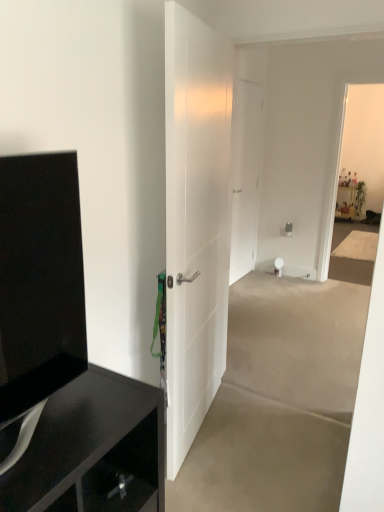
Describe the element at coordinates (92, 450) in the screenshot. Image resolution: width=384 pixels, height=512 pixels. I see `black glossy cabinet at left` at that location.

This screenshot has height=512, width=384. Describe the element at coordinates (245, 176) in the screenshot. I see `white matte door at center, which is the first door from back to front` at that location.

Identify the location of white smooth door at center, the first door positioned from the front. (195, 221).

Can you confirm if black glossy tv cabinet at left is taller than black glossy cabinet at left?

Incorrect, the height of black glossy tv cabinet at left is not larger of that of black glossy cabinet at left.

You are a GUI agent. You are given a task and a screenshot of the screen. Output one action in this format:
    pyautogui.click(x=<x>, y=<y>)
    Task: Click on the cabinetry on the right side of black glossy tv cabinet at left
    This screenshot has width=384, height=512.
    Given the screenshot: What is the action you would take?
    pyautogui.click(x=92, y=450)

Is the surface of black glossy tv cabinet at left in direct contact with black glossy cabinet at left?

No, black glossy tv cabinet at left is not in contact with black glossy cabinet at left.

Consider the image. Would you say black glossy tv cabinet at left is outside black glossy cabinet at left?

Indeed, black glossy tv cabinet at left is completely outside black glossy cabinet at left.

In the scene shown: From the image's perspective, is white smooth door at center, which is the 2th door in back-to-front order, located above black glossy tv cabinet at left?

Yes, from the image's perspective, white smooth door at center, which is the 2th door in back-to-front order, is on top of black glossy tv cabinet at left.

Looking at this image, does white smooth door at center, arranged as the second door when viewed from the right, have a smaller size compared to black glossy tv cabinet at left?

Incorrect, white smooth door at center, arranged as the second door when viewed from the right, is not smaller in size than black glossy tv cabinet at left.

Which of these two, white smooth door at center, the first door in the left-to-right sequence, or black glossy tv cabinet at left, is thinner?

white smooth door at center, the first door in the left-to-right sequence, is thinner.

Is white smooth door at center, the first door positioned from the front, facing towards black glossy tv cabinet at left?

No, white smooth door at center, the first door positioned from the front, does not turn towards black glossy tv cabinet at left.

Consider the image. Can you confirm if white matte door at center, the first door when ordered from right to left, is positioned to the left of black glossy cabinet at left?

Incorrect, white matte door at center, the first door when ordered from right to left, is not on the left side of black glossy cabinet at left.

Is white matte door at center, which is the second door from left to right, wider or thinner than black glossy cabinet at left?

Clearly, white matte door at center, which is the second door from left to right, has less width compared to black glossy cabinet at left.

From the picture: From a real-world perspective, between white matte door at center, which is counted as the 2th door, starting from the front, and black glossy cabinet at left, who is vertically lower?

black glossy cabinet at left is physically lower.

What's the angular difference between black glossy cabinet at left and black glossy tv cabinet at left's facing directions?

0.434 degrees.

Is black glossy cabinet at left positioned far away from black glossy tv cabinet at left?

No, black glossy cabinet at left is not far away from black glossy tv cabinet at left.

Does point (68, 410) come in front of point (1, 250)?

No, it is behind (1, 250).

Is white matte door at center, which is the first door from back to front, wider or thinner than white smooth door at center, the first door positioned from the front?

In the image, white matte door at center, which is the first door from back to front, appears to be more narrow than white smooth door at center, the first door positioned from the front.

Based on their positions, is white matte door at center, which is the first door from back to front, located to the left or right of white smooth door at center, the first door positioned from the front?

Based on their positions, white matte door at center, which is the first door from back to front, is located to the right of white smooth door at center, the first door positioned from the front.

Is white matte door at center, which is counted as the 2th door, starting from the front, situated inside white smooth door at center, which is the 2th door in back-to-front order, or outside?

white matte door at center, which is counted as the 2th door, starting from the front, cannot be found inside white smooth door at center, which is the 2th door in back-to-front order.

From a real-world perspective, is white matte door at center, which is the second door from left to right, over white smooth door at center, the first door in the left-to-right sequence?

Yes, from a real-world perspective, white matte door at center, which is the second door from left to right, is over white smooth door at center, the first door in the left-to-right sequence

Can you see black glossy cabinet at left touching white smooth door at center, the first door positioned from the front?

No, black glossy cabinet at left is not next to white smooth door at center, the first door positioned from the front.

Is black glossy cabinet at left to the left of white smooth door at center, arranged as the second door when viewed from the right, from the viewer's perspective?

Correct, you'll find black glossy cabinet at left to the left of white smooth door at center, arranged as the second door when viewed from the right.

What's the angular difference between black glossy cabinet at left and white smooth door at center, the first door in the left-to-right sequence,'s facing directions?

11.6 degrees separate the facing orientations of black glossy cabinet at left and white smooth door at center, the first door in the left-to-right sequence.

Is white smooth door at center, arranged as the second door when viewed from the right, a part of black glossy cabinet at left?

That's incorrect, white smooth door at center, arranged as the second door when viewed from the right, is not inside black glossy cabinet at left.

Is the depth of black glossy tv cabinet at left greater than that of white smooth door at center, arranged as the second door when viewed from the right?

No, the depth of black glossy tv cabinet at left is less than that of white smooth door at center, arranged as the second door when viewed from the right.

How different are the orientations of black glossy tv cabinet at left and white smooth door at center, the first door in the left-to-right sequence, in degrees?

They differ by 12 degrees in their facing directions.

Is black glossy tv cabinet at left bigger than white smooth door at center, arranged as the second door when viewed from the right?

No.

Which door is the 1st one when counting from the right side of the black glossy tv cabinet at left? Please provide its 2D coordinates.

[(195, 221)]

Image resolution: width=384 pixels, height=512 pixels. What are the coordinates of `cabinetry behind the black glossy tv cabinet at left` in the screenshot? It's located at (92, 450).

The image size is (384, 512). I want to click on tv cabinet below the white smooth door at center, arranged as the second door when viewed from the right (from the image's perspective), so click(39, 286).

Looking at the image, which one is located closer to white matte door at center, which is the first door from back to front, black glossy cabinet at left or white smooth door at center, the first door positioned from the front?

white smooth door at center, the first door positioned from the front, lies closer to white matte door at center, which is the first door from back to front, than the other object.

Based on their spatial positions, is white matte door at center, which is the second door from left to right, or black glossy tv cabinet at left further from white smooth door at center, the first door in the left-to-right sequence?

white matte door at center, which is the second door from left to right.

From the image, which object appears to be nearer to white smooth door at center, which is the 2th door in back-to-front order, black glossy tv cabinet at left or white matte door at center, which is counted as the 2th door, starting from the front?

Based on the image, black glossy tv cabinet at left appears to be nearer to white smooth door at center, which is the 2th door in back-to-front order.

Considering their positions, is black glossy tv cabinet at left positioned further to white matte door at center, which is the first door from back to front, than black glossy cabinet at left?

black glossy tv cabinet at left is positioned further to the anchor white matte door at center, which is the first door from back to front.

Which object lies nearer to the anchor point white matte door at center, which is the first door from back to front, black glossy cabinet at left or black glossy tv cabinet at left?

black glossy cabinet at left is positioned closer to the anchor white matte door at center, which is the first door from back to front.

Which object lies further to the anchor point white smooth door at center, the first door positioned from the front, black glossy cabinet at left or white matte door at center, which is the first door from back to front?

Among the two, white matte door at center, which is the first door from back to front, is located further to white smooth door at center, the first door positioned from the front.

Looking at the image, which one is located closer to black glossy tv cabinet at left, white matte door at center, the first door when ordered from right to left, or white smooth door at center, the first door in the left-to-right sequence?

Among the two, white smooth door at center, the first door in the left-to-right sequence, is located nearer to black glossy tv cabinet at left.

Looking at the image, which one is located closer to black glossy tv cabinet at left, white smooth door at center, which is the 2th door in back-to-front order, or black glossy cabinet at left?

black glossy cabinet at left lies closer to black glossy tv cabinet at left than the other object.

Find the location of a particular element. The height and width of the screenshot is (512, 384). cabinetry located between black glossy tv cabinet at left and white matte door at center, which is counted as the 2th door, starting from the front, in the depth direction is located at coordinates (92, 450).

Find the location of a particular element. This screenshot has width=384, height=512. door positioned between black glossy cabinet at left and white matte door at center, which is the first door from back to front, from near to far is located at coordinates (195, 221).

You are a GUI agent. You are given a task and a screenshot of the screen. Output one action in this format:
    pyautogui.click(x=<x>, y=<y>)
    Task: Click on the tv cabinet between white smooth door at center, arranged as the second door when viewed from the right, and black glossy cabinet at left vertically
    The height and width of the screenshot is (512, 384).
    Given the screenshot: What is the action you would take?
    pyautogui.click(x=39, y=286)

The height and width of the screenshot is (512, 384). In order to click on door positioned between black glossy tv cabinet at left and white matte door at center, the first door when ordered from right to left, from near to far in this screenshot , I will do `click(195, 221)`.